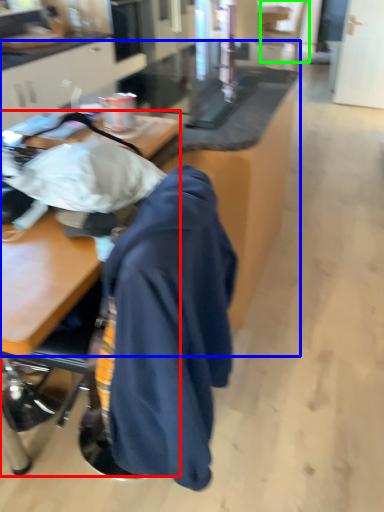
Question: Considering the real-world distances, which object is farthest from desk (highlighted by a red box)? table (highlighted by a blue box) or swivel chair (highlighted by a green box)?

Choices:
 (A) table
 (B) swivel chair

Answer: (B)